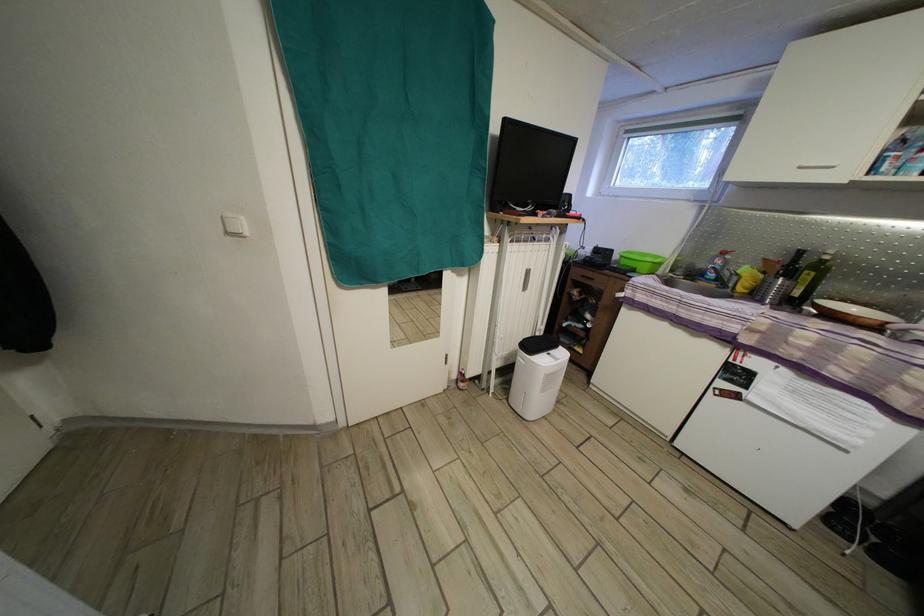
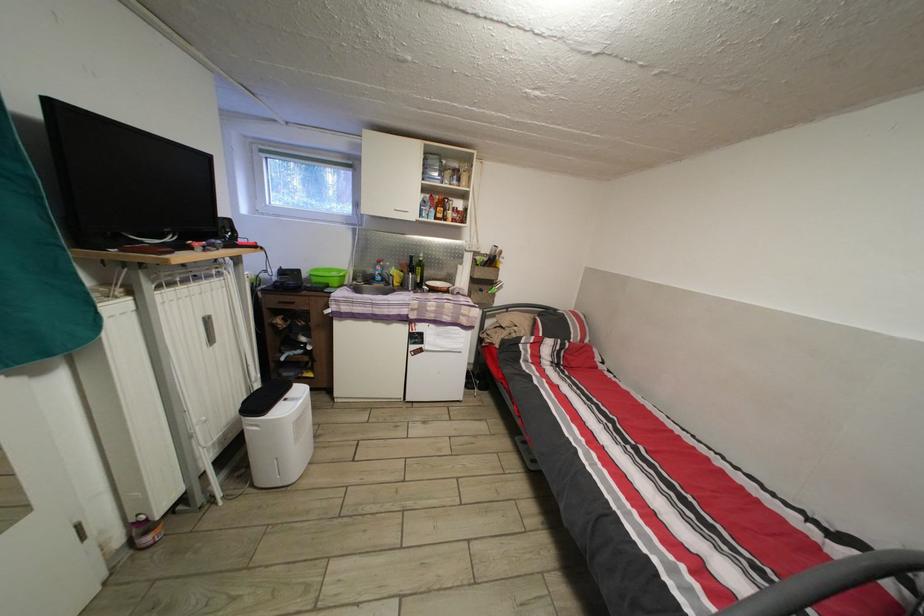
The point at (537, 253) is marked in the first image. Where is the corresponding point in the second image?

(201, 294)